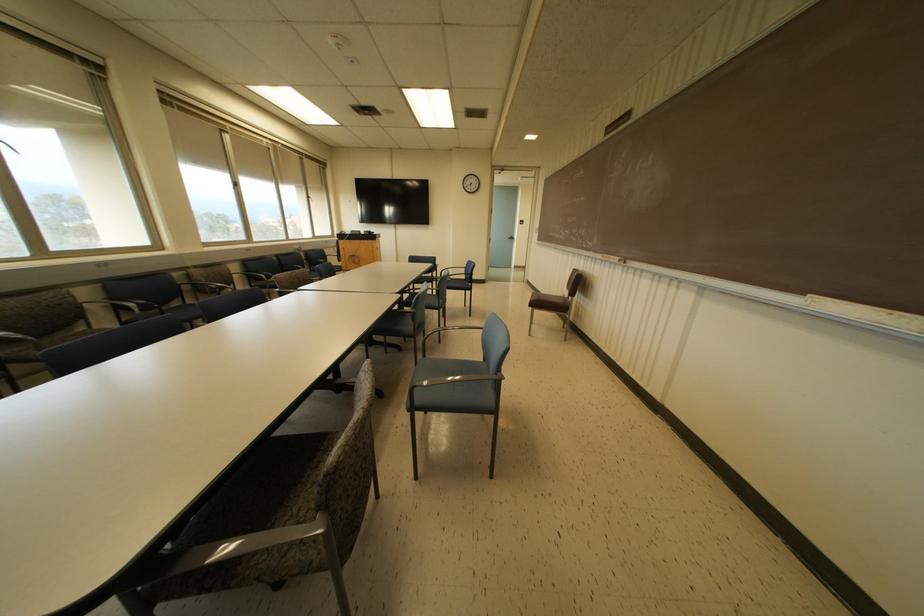
Find where to sit the blue chair sitting surface. Please return your answer as a coordinate pair (x, y).

(444, 368)